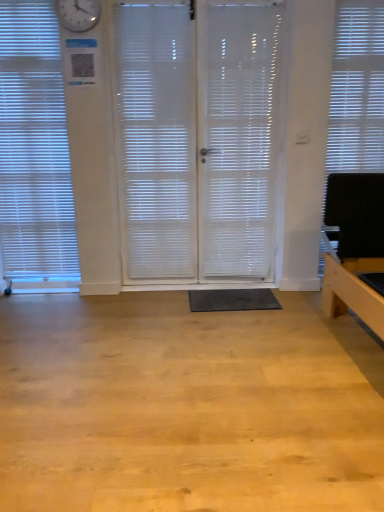
Question: Is white frosted glass shutter at center spatially inside white matte window blind at right, which is counted as the second window blind, starting from the left, or outside of it?

Choices:
 (A) inside
 (B) outside

Answer: (B)

Question: Based on their sizes in the image, would you say white frosted glass shutter at center is bigger or smaller than white matte window blind at right, which is counted as the second window blind, starting from the left?

Choices:
 (A) small
 (B) big

Answer: (B)

Question: Considering the real-world distances, which object is closest to the white matte window blind at right, which is counted as the second window blind, starting from the left?

Choices:
 (A) white frosted glass shutter at center
 (B) transparent plastic screen door at center, the 1th screen door positioned from the left
 (C) black rubber mat at center
 (D) white translucent blinds at left, the 2th window blind viewed from the right
 (E) white translucent screen door at center, arranged as the 2th screen door when viewed from the left

Answer: (E)

Question: Estimate the real-world distances between objects in this image. Which object is closer to the black rubber mat at center?

Choices:
 (A) white translucent blinds at left, the 2th window blind viewed from the right
 (B) transparent plastic screen door at center, the 1th screen door positioned from the left
 (C) white frosted glass shutter at center
 (D) white translucent screen door at center, arranged as the 2th screen door when viewed from the left
 (E) white matte window blind at right, which is the first window blind in right-to-left order

Answer: (D)